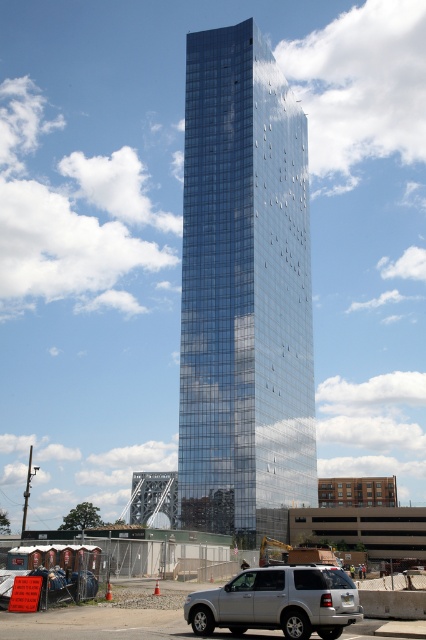
Is glossy glass tower at center wider than silver metallic suv at lower center?

Indeed, glossy glass tower at center has a greater width compared to silver metallic suv at lower center.

Does glossy glass tower at center appear on the left side of silver metallic suv at lower center?

Incorrect, glossy glass tower at center is not on the left side of silver metallic suv at lower center.

This screenshot has height=640, width=426. What do you see at coordinates (244, 292) in the screenshot? I see `glossy glass tower at center` at bounding box center [244, 292].

What are the coordinates of `glossy glass tower at center` in the screenshot? It's located at (244, 292).